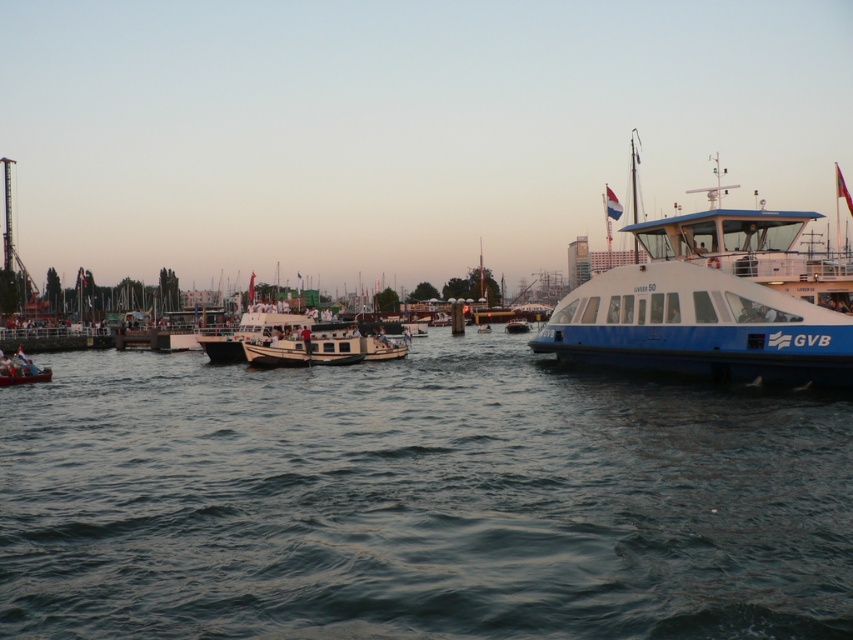
Question: Which of the following is the farthest from the observer?

Choices:
 (A) blue glossy ferry at right
 (B) white glossy boat at center

Answer: (B)

Question: Does blue glossy ferry at right have a smaller size compared to wooden canoe at lower left?

Choices:
 (A) yes
 (B) no

Answer: (A)

Question: Which object is positioned closest to the blue glossy ferry at right?

Choices:
 (A) dark blue water at center
 (B) white glossy boat at center

Answer: (A)

Question: Which is nearer to the dark blue water at center?

Choices:
 (A) white glossy boat at center
 (B) wooden canoe at lower left

Answer: (B)

Question: Is dark blue water at center positioned in front of wooden canoe at lower left?

Choices:
 (A) yes
 (B) no

Answer: (A)

Question: Is wooden canoe at lower left positioned at the back of white glossy boat at center?

Choices:
 (A) no
 (B) yes

Answer: (A)